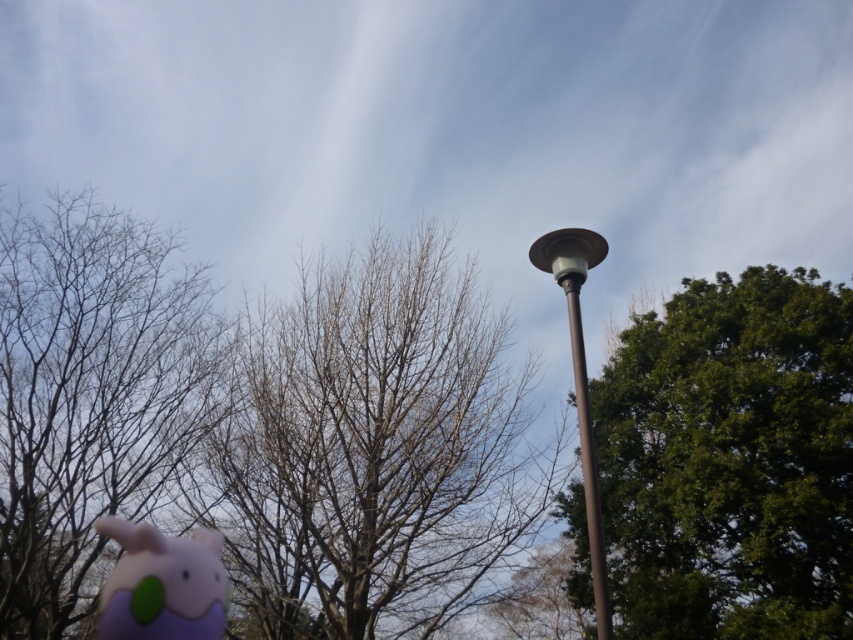
Question: Can you confirm if purple felt plushie at lower left is bigger than brown metallic pole at center?

Choices:
 (A) no
 (B) yes

Answer: (B)

Question: Which of the following is the farthest from the observer?

Choices:
 (A) bare wood tree at center
 (B) green leafy tree at right
 (C) bare branches at left
 (D) polished metal street light at upper right

Answer: (C)

Question: Which of the following is the closest to the observer?

Choices:
 (A) bare wood tree at center
 (B) bare branches at left
 (C) polished metal street light at upper right
 (D) green leafy tree at right

Answer: (C)

Question: Does green leafy tree at right have a lesser width compared to brown metallic pole at center?

Choices:
 (A) no
 (B) yes

Answer: (A)

Question: Where is green leafy tree at right located in relation to brown metallic pole at center in the image?

Choices:
 (A) left
 (B) right

Answer: (B)

Question: Based on their relative distances, which object is farther from the brown metallic pole at center?

Choices:
 (A) bare wood tree at center
 (B) polished metal street light at upper right
 (C) green leafy tree at right

Answer: (A)